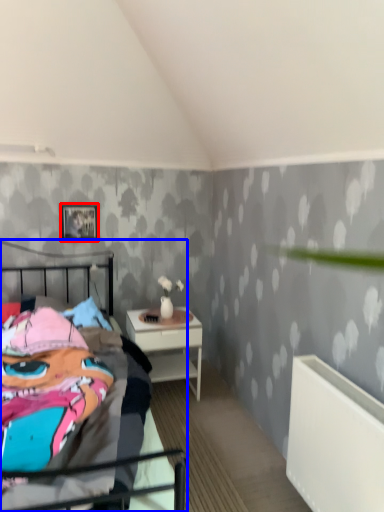
Question: Which point is closer to the camera, picture frame (highlighted by a red box) or bed (highlighted by a blue box)?

Choices:
 (A) picture frame
 (B) bed

Answer: (B)